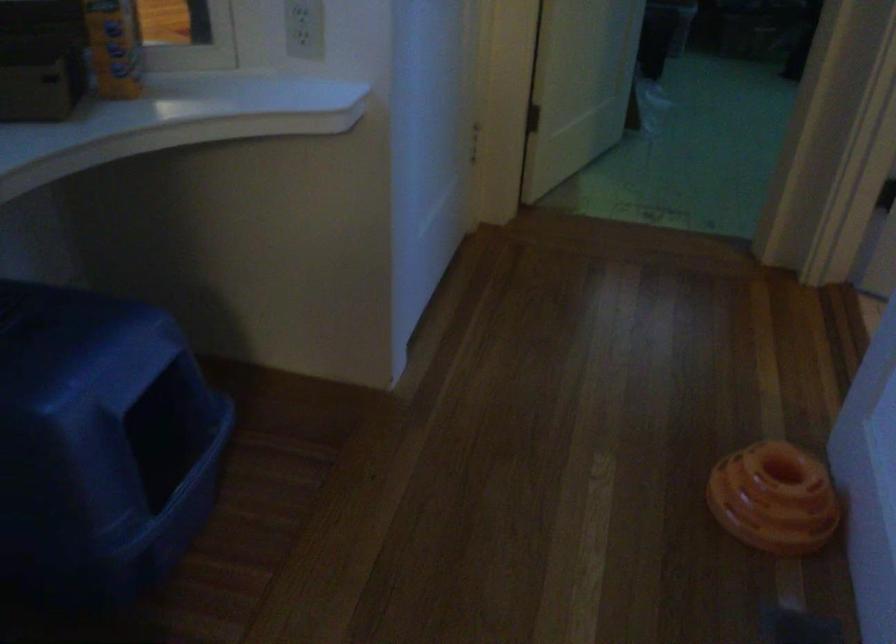
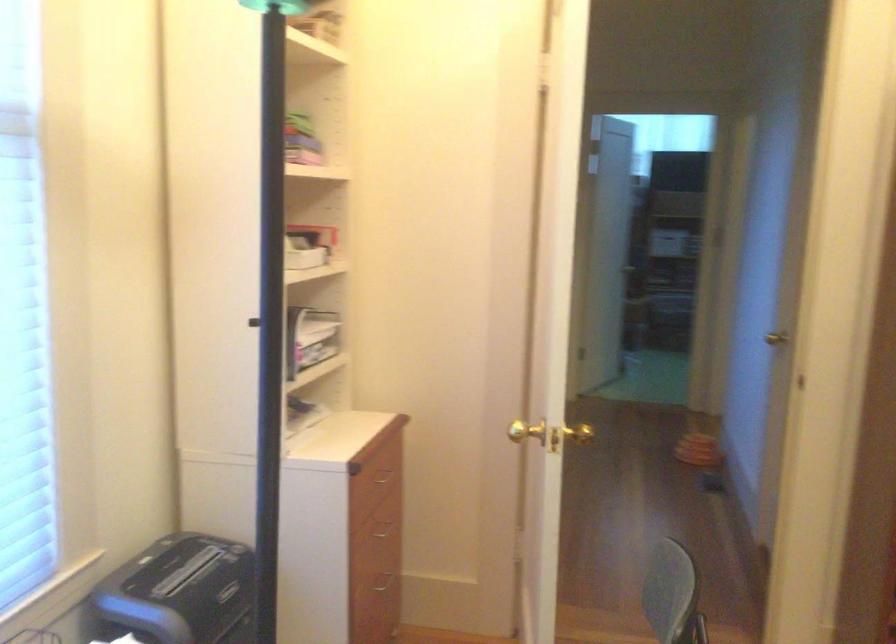
Question: I am providing you with two images of the same scene from different viewpoints. Which of the following objects are not visible in image2?

Choices:
 (A) drawer handle
 (B) orange ring toy
 (C) black paper shredder
 (D) square control button

Answer: (B)